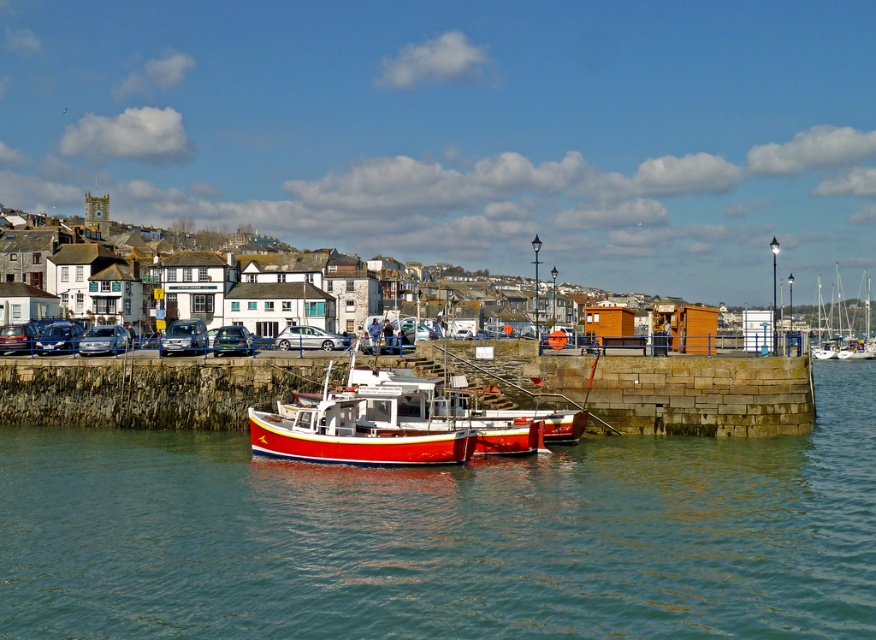
In the scene shown: Does metallic silver van at center have a lesser height compared to matte black car at left?

Incorrect, metallic silver van at center's height does not fall short of matte black car at left's.

Does metallic silver van at center have a greater height compared to matte black car at left?

Indeed, metallic silver van at center has a greater height compared to matte black car at left.

Who is more distant from viewer, [175,333] or [1,346]?

Point [1,346]

Find the location of a particular element. The image size is (876, 640). metallic silver van at center is located at coordinates (184, 337).

Between red matte boat at center and satin silver car at center, which one has more height?

red matte boat at center

The width and height of the screenshot is (876, 640). I want to click on red matte boat at center, so click(350, 436).

At what (x,y) coordinates should I click in order to perform the action: click on red matte boat at center. Please return your answer as a coordinate pair (x, y). The width and height of the screenshot is (876, 640). Looking at the image, I should click on (350, 436).

Can you confirm if transparent water at center is positioned above matte black car at left?

No.

Is point (555, 472) positioned after point (25, 324)?

No, (555, 472) is closer to viewer.

Which is in front, point (405, 496) or point (2, 332)?

Point (405, 496) is in front.

You are a GUI agent. You are given a task and a screenshot of the screen. Output one action in this format:
    pyautogui.click(x=<x>, y=<y>)
    Task: Click on the transparent water at center
    
    Given the screenshot: What is the action you would take?
    pyautogui.click(x=444, y=536)